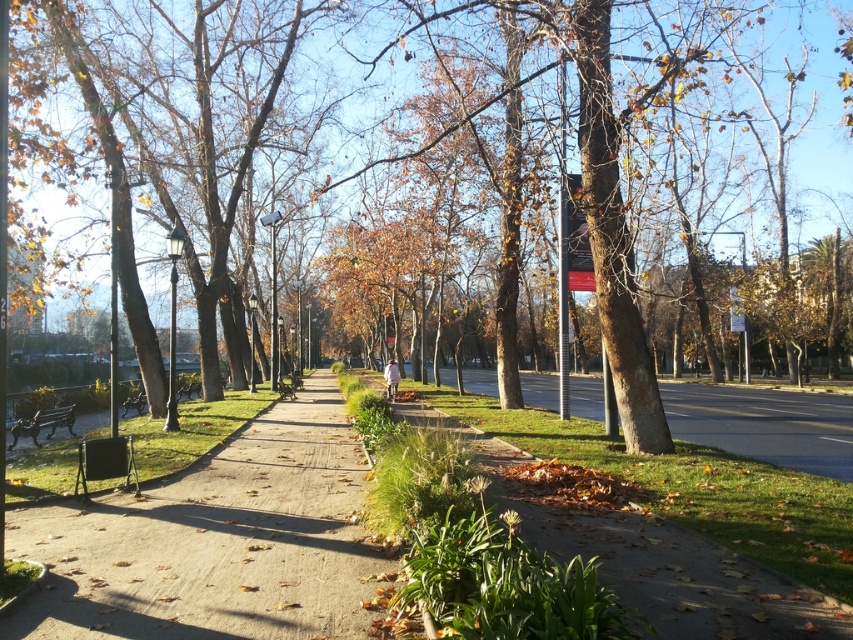
Question: Estimate the real-world distances between objects in this image. Which object is closer to the smooth concrete path at center?

Choices:
 (A) brown wood tree at center
 (B) brown gravel sidewalk at center

Answer: (A)

Question: Is green leafy grass at center to the right of brown gravel sidewalk at center from the viewer's perspective?

Choices:
 (A) no
 (B) yes

Answer: (A)

Question: Which object is the farthest from the brown wood tree at center?

Choices:
 (A) brown gravel sidewalk at center
 (B) wooden park bench at center-left

Answer: (B)

Question: Can you confirm if brown gravel sidewalk at center is positioned below wooden bench at left?

Choices:
 (A) yes
 (B) no

Answer: (A)

Question: Estimate the real-world distances between objects in this image. Which object is farther from the wooden park bench at center-left?

Choices:
 (A) brown wood tree at center
 (B) green grass at lower left

Answer: (A)

Question: Does green leafy grass at center lie behind green grass at lower left?

Choices:
 (A) no
 (B) yes

Answer: (A)